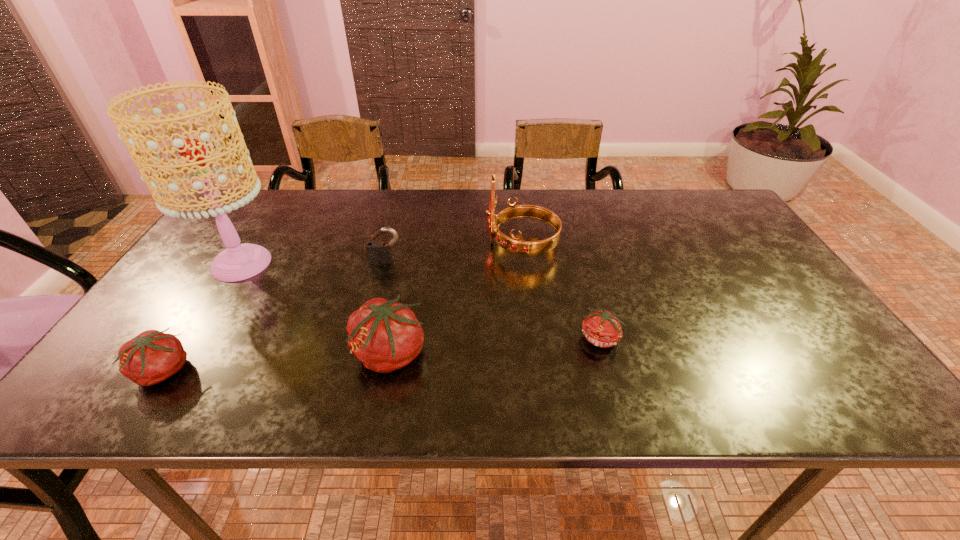
Identify the location of free space between the tiara and the tallest tomato. This screenshot has height=540, width=960. (456, 300).

In order to click on free area in between the leftmost tomato and the second tallest object in this screenshot , I will do `click(342, 308)`.

Where is `free space between the second object from right to left and the fourth tallest object`? The height and width of the screenshot is (540, 960). free space between the second object from right to left and the fourth tallest object is located at coordinates (454, 253).

Where is `vacant area between the second object from right to left and the fourth tallest object`? This screenshot has width=960, height=540. vacant area between the second object from right to left and the fourth tallest object is located at coordinates (454, 253).

You are a GUI agent. You are given a task and a screenshot of the screen. Output one action in this format:
    pyautogui.click(x=<x>, y=<y>)
    Task: Click on the object that stands as the third closest to the shortest tomato
    Image resolution: width=960 pixels, height=540 pixels.
    Given the screenshot: What is the action you would take?
    pyautogui.click(x=379, y=252)

Select which object is the fifth closest to the fifth shortest object. Please provide its 2D coordinates. Your answer should be formatted as a tuple, i.e. [(x, y)], where the tuple contains the x and y coordinates of a point satisfying the conditions above.

[(151, 357)]

What are the coordinates of `the second closest tomato to the second tomato from right to left` in the screenshot? It's located at (601, 328).

Image resolution: width=960 pixels, height=540 pixels. Find the location of `tomato that is the third closest to the lampshade`. tomato that is the third closest to the lampshade is located at coordinates (601, 328).

Where is `free space that satisfies the following two spatial constraints: 1. with the keyhole on the front of the padlock; 2. on the right side of the rightmost object`? Image resolution: width=960 pixels, height=540 pixels. free space that satisfies the following two spatial constraints: 1. with the keyhole on the front of the padlock; 2. on the right side of the rightmost object is located at coordinates (367, 339).

Locate an element on the screen. The image size is (960, 540). blank space that satisfies the following two spatial constraints: 1. on the front-facing side of the shortest object; 2. on the right side of the second object from right to left is located at coordinates (533, 339).